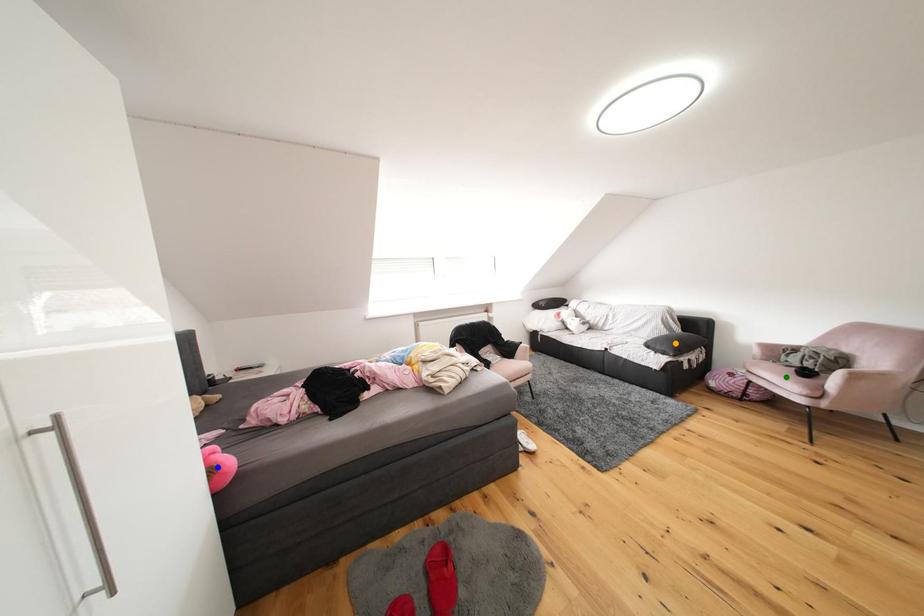
Order these from nearest to farthest:
A) blue point
B) green point
C) orange point

blue point < green point < orange point